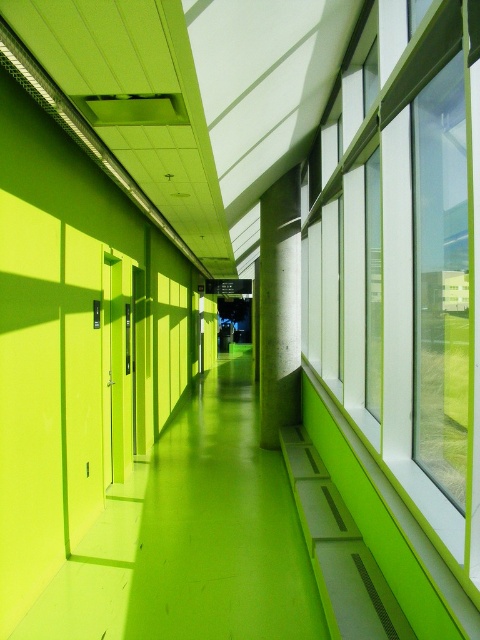
Question: Is transparent glass windows at right closer to camera compared to green concrete pillar at center?

Choices:
 (A) no
 (B) yes

Answer: (B)

Question: Which point appears farthest from the camera in this image?

Choices:
 (A) (456, 509)
 (B) (280, 376)

Answer: (B)

Question: Is transparent glass windows at right below green concrete pillar at center?

Choices:
 (A) yes
 (B) no

Answer: (B)

Question: Which point appears closest to the camera in this image?

Choices:
 (A) (289, 410)
 (B) (471, 266)

Answer: (B)

Question: Is transparent glass windows at right further to the viewer compared to green concrete pillar at center?

Choices:
 (A) no
 (B) yes

Answer: (A)